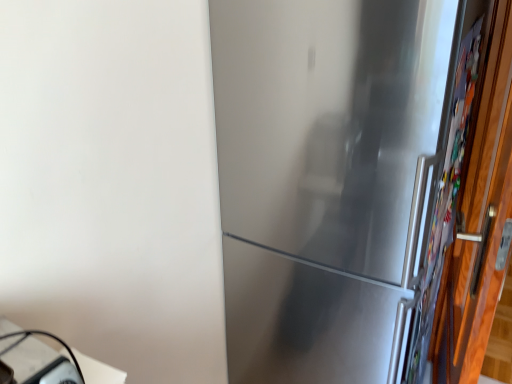
What do you see at coordinates (40, 364) in the screenshot? The image size is (512, 384). I see `white glossy table at lower left` at bounding box center [40, 364].

You are a GUI agent. You are given a task and a screenshot of the screen. Output one action in this format:
    pyautogui.click(x=<x>, y=<y>)
    Task: Click on the white glossy table at lower left
    
    Given the screenshot: What is the action you would take?
    pyautogui.click(x=40, y=364)

Describe the element at coordinates (478, 220) in the screenshot. The height and width of the screenshot is (384, 512). I see `wooden door at right` at that location.

At what (x,y) coordinates should I click in order to perform the action: click on satin silver refrigerator at center. Please return your answer as a coordinate pair (x, y). The width and height of the screenshot is (512, 384). Looking at the image, I should click on (362, 185).

From a real-world perspective, which is physically below, satin silver refrigerator at center or wooden door at right?

In real-world perspective, wooden door at right is lower.

Is point (459, 53) closer to viewer compared to point (478, 254)?

Yes, it is.

Are satin silver refrigerator at center and wooden door at right beside each other?

satin silver refrigerator at center and wooden door at right are not in contact.

Looking at this image, considering the sizes of satin silver refrigerator at center and wooden door at right in the image, is satin silver refrigerator at center taller or shorter than wooden door at right?

Considering their sizes, satin silver refrigerator at center has more height than wooden door at right.

Is white glossy table at lower left aimed at satin silver refrigerator at center?

No, white glossy table at lower left is not oriented towards satin silver refrigerator at center.

Is white glossy table at lower left far away from satin silver refrigerator at center?

white glossy table at lower left is actually quite close to satin silver refrigerator at center.

Locate an element on the screen. table lying below the satin silver refrigerator at center (from the image's perspective) is located at coordinates (40, 364).

From a real-world perspective, is white glossy table at lower left located beneath satin silver refrigerator at center?

Correct, in the physical world, white glossy table at lower left is lower than satin silver refrigerator at center.

Consider the image. Which object is wider, wooden door at right or satin silver refrigerator at center?

satin silver refrigerator at center is wider.

From the image's perspective, would you say wooden door at right is shown under satin silver refrigerator at center?

Yes.

From a real-world perspective, which object rests below the other?

wooden door at right is physically lower.

Image resolution: width=512 pixels, height=384 pixels. What are the coordinates of `table below the satin silver refrigerator at center (from a real-world perspective)` in the screenshot? It's located at (40, 364).

From the image's perspective, is satin silver refrigerator at center positioned above or below white glossy table at lower left?

Based on their image positions, satin silver refrigerator at center is located above white glossy table at lower left.

From the picture: Are satin silver refrigerator at center and white glossy table at lower left far apart?

They are positioned close to each other.

Does satin silver refrigerator at center contain white glossy table at lower left?

No, white glossy table at lower left is located outside of satin silver refrigerator at center.

Considering the sizes of white glossy table at lower left and wooden door at right in the image, is white glossy table at lower left bigger or smaller than wooden door at right?

Clearly, white glossy table at lower left is smaller in size than wooden door at right.

What's the angular difference between white glossy table at lower left and wooden door at right's facing directions?

The facing directions of white glossy table at lower left and wooden door at right are 13.2 degrees apart.

Can we say white glossy table at lower left lies outside wooden door at right?

Yes, white glossy table at lower left is located beyond the bounds of wooden door at right.

From the image's perspective, does wooden door at right appear higher than white glossy table at lower left?

Correct, wooden door at right appears higher than white glossy table at lower left in the image.

Locate an element on the screen. The image size is (512, 384). door that is above the white glossy table at lower left (from the image's perspective) is located at coordinates (478, 220).

Can you tell me how much wooden door at right and white glossy table at lower left differ in facing direction?

The angular difference between wooden door at right and white glossy table at lower left is 13.2 degrees.

Is wooden door at right surrounding white glossy table at lower left?

No, white glossy table at lower left is not a part of wooden door at right.

The height and width of the screenshot is (384, 512). Find the location of `door below the satin silver refrigerator at center (from the image's perspective)`. door below the satin silver refrigerator at center (from the image's perspective) is located at coordinates (478, 220).

Identify the location of table that is under the satin silver refrigerator at center (from a real-world perspective). (40, 364).

Based on their spatial positions, is satin silver refrigerator at center or wooden door at right further from white glossy table at lower left?

Based on the image, wooden door at right appears to be further to white glossy table at lower left.

Considering their positions, is white glossy table at lower left positioned closer to satin silver refrigerator at center than wooden door at right?

wooden door at right is positioned closer to the anchor satin silver refrigerator at center.

Based on their spatial positions, is white glossy table at lower left or satin silver refrigerator at center further from wooden door at right?

white glossy table at lower left lies further to wooden door at right than the other object.

When comparing their distances from white glossy table at lower left, does wooden door at right or satin silver refrigerator at center seem closer?

Among the two, satin silver refrigerator at center is located nearer to white glossy table at lower left.

In the scene shown: Based on their spatial positions, is satin silver refrigerator at center or white glossy table at lower left closer to wooden door at right?

Among the two, satin silver refrigerator at center is located nearer to wooden door at right.

From the image, which object appears to be farther from satin silver refrigerator at center, wooden door at right or white glossy table at lower left?

Among the two, white glossy table at lower left is located further to satin silver refrigerator at center.

Image resolution: width=512 pixels, height=384 pixels. What are the coordinates of `refrigerator between white glossy table at lower left and wooden door at right` in the screenshot? It's located at (362, 185).